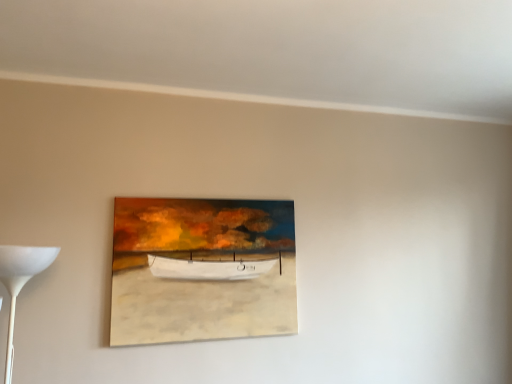
Describe the element at coordinates (202, 270) in the screenshot. Image resolution: width=512 pixels, height=384 pixels. I see `matte canvas painting at center` at that location.

Find the location of `matte canvas painting at center`. matte canvas painting at center is located at coordinates (202, 270).

Where is `matte canvas painting at center`? Image resolution: width=512 pixels, height=384 pixels. matte canvas painting at center is located at coordinates (202, 270).